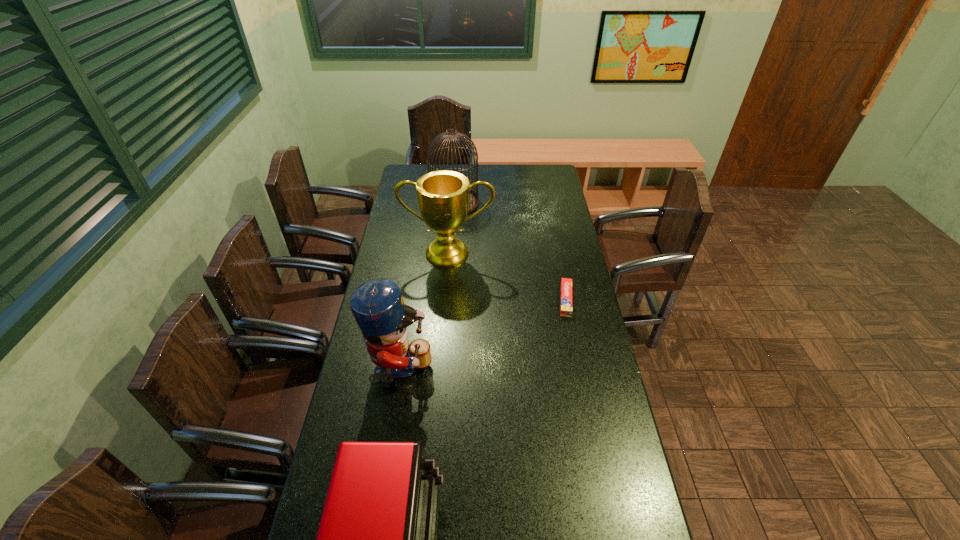
Locate an element on the screen. free space that satisfies the following two spatial constraints: 1. on the front side of the shortest object; 2. on the left side of the farthest object is located at coordinates (447, 300).

Where is `blank space that satisfies the following two spatial constraints: 1. on the front side of the third nearest object; 2. on the front-facing side of the nutcracker`? Image resolution: width=960 pixels, height=540 pixels. blank space that satisfies the following two spatial constraints: 1. on the front side of the third nearest object; 2. on the front-facing side of the nutcracker is located at coordinates (580, 372).

The width and height of the screenshot is (960, 540). In order to click on free space that satisfies the following two spatial constraints: 1. on the shiny surface of the award; 2. on the front-facing side of the nutcracker in this screenshot , I will do `click(439, 372)`.